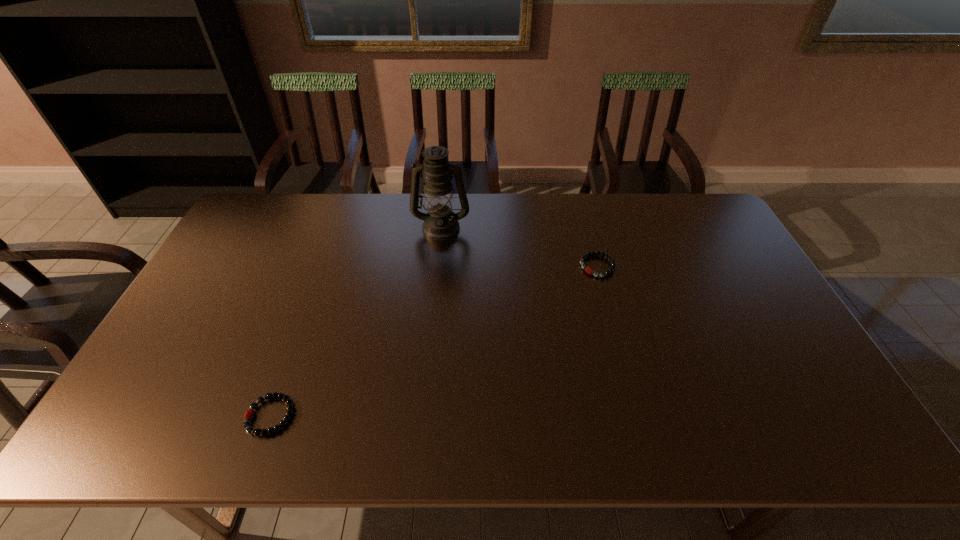
Where is `object that is at the near edge`? The height and width of the screenshot is (540, 960). object that is at the near edge is located at coordinates (249, 415).

Identify the location of vacant space at the far edge of the desktop. (629, 207).

Where is `vacant area at the near edge of the desktop`? This screenshot has width=960, height=540. vacant area at the near edge of the desktop is located at coordinates (644, 449).

At what (x,y) coordinates should I click in order to perform the action: click on vacant area at the left edge of the desktop. Please return your answer as a coordinate pair (x, y). Looking at the image, I should click on pos(234,246).

The width and height of the screenshot is (960, 540). In order to click on vacant space at the right edge of the desktop in this screenshot , I will do `click(757, 359)`.

Where is `vacant space at the far left corner`? The height and width of the screenshot is (540, 960). vacant space at the far left corner is located at coordinates (251, 210).

Where is `free region at the near left corner of the desktop`? This screenshot has height=540, width=960. free region at the near left corner of the desktop is located at coordinates (120, 441).

You are a GUI agent. You are given a task and a screenshot of the screen. Output one action in this format:
    pyautogui.click(x=<x>, y=<y>)
    Task: Click on the vacant area at the far right corner
    The image size is (960, 540).
    Given the screenshot: What is the action you would take?
    pyautogui.click(x=678, y=214)

This screenshot has width=960, height=540. Identify the location of empty location between the rightmost object and the nearest object. (434, 341).

At what (x,y) coordinates should I click in order to perform the action: click on empty space between the right bracelet and the farthest object. Please return your answer as a coordinate pair (x, y). The image size is (960, 540). Looking at the image, I should click on (519, 247).